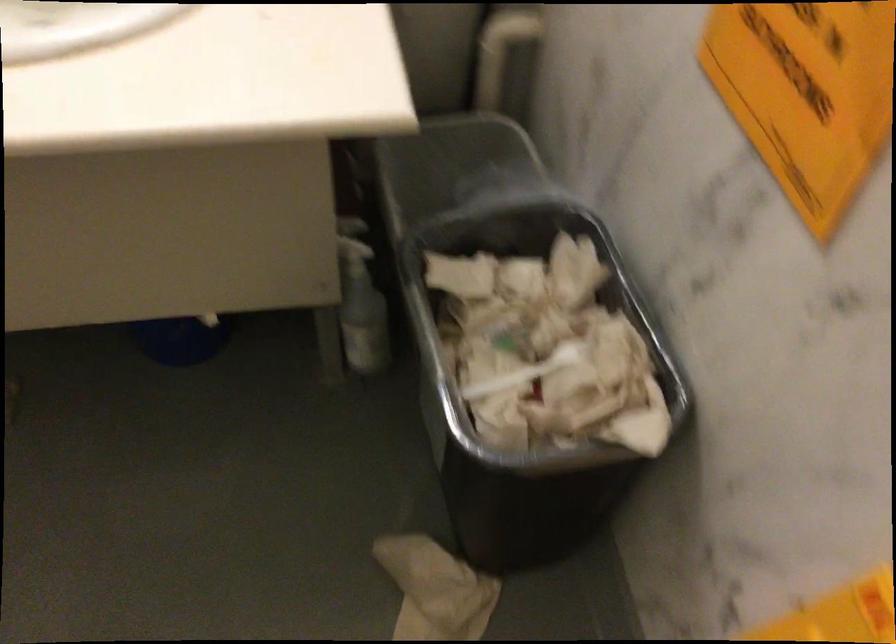
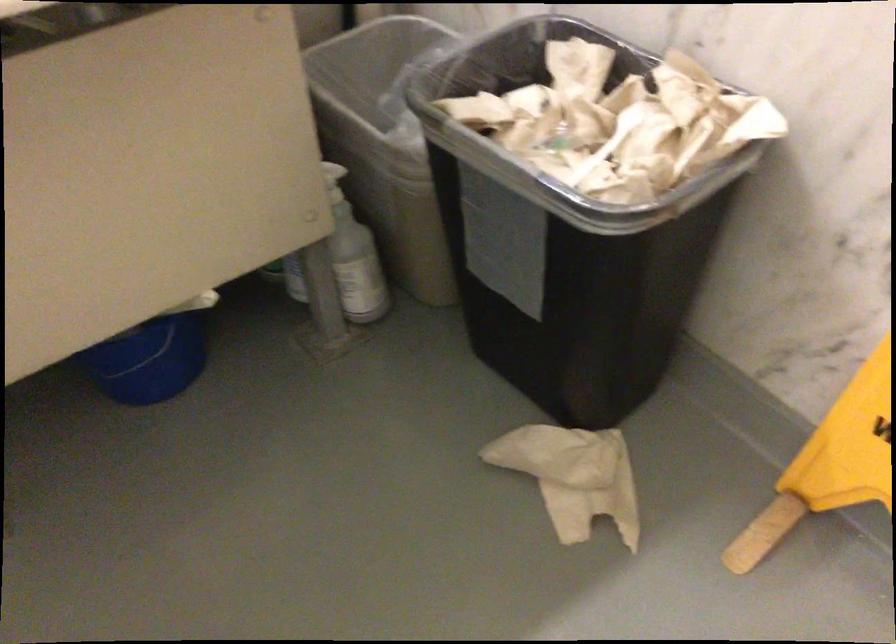
The point at (354, 252) is marked in the first image. Where is the corresponding point in the second image?

(333, 182)